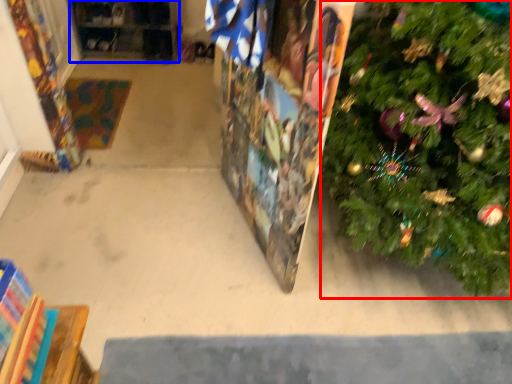
Question: Which point is closer to the camera, christmas tree (highlighted by a red box) or shelf (highlighted by a blue box)?

Choices:
 (A) christmas tree
 (B) shelf

Answer: (A)